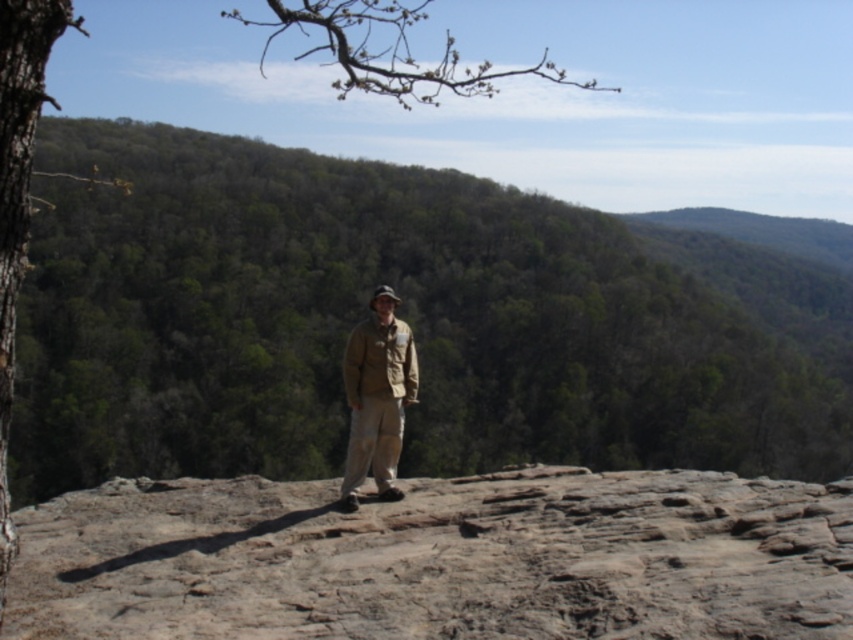
Which is in front, point (287, 284) or point (20, 168)?

Point (20, 168)

Is point (183, 141) positioned in front of point (329, 4)?

That is False.

Where is `green leafy mountain at center`? This screenshot has width=853, height=640. green leafy mountain at center is located at coordinates (364, 316).

Identify the location of green leafy mountain at center. (364, 316).

Which is more to the right, brown rocky hillside at center or khaki fabric jacket at center?

khaki fabric jacket at center

Does brown rocky hillside at center have a greater height compared to khaki fabric jacket at center?

In fact, brown rocky hillside at center may be shorter than khaki fabric jacket at center.

Between point (577, 512) and point (383, 330), which one is positioned behind?

Point (383, 330)

Where is `brown rocky hillside at center`? brown rocky hillside at center is located at coordinates (440, 560).

Is green leafy mountain at center wider than brown rocky hillside at center?

Yes, green leafy mountain at center is wider than brown rocky hillside at center.

The image size is (853, 640). In order to click on green leafy mountain at center in this screenshot , I will do `click(364, 316)`.

Locate an element on the screen. green leafy mountain at center is located at coordinates (364, 316).